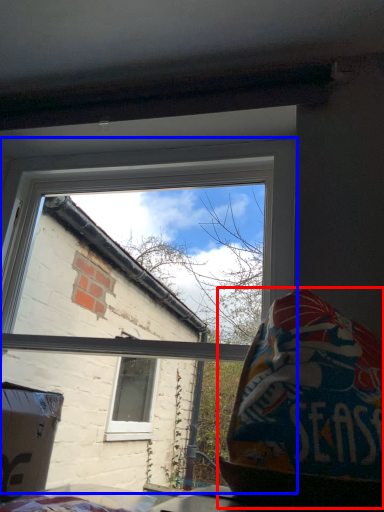
Question: Which of the following is the farthest to the observer, bean bag chair (highlighted by a red box) or window (highlighted by a blue box)?

Choices:
 (A) bean bag chair
 (B) window

Answer: (B)